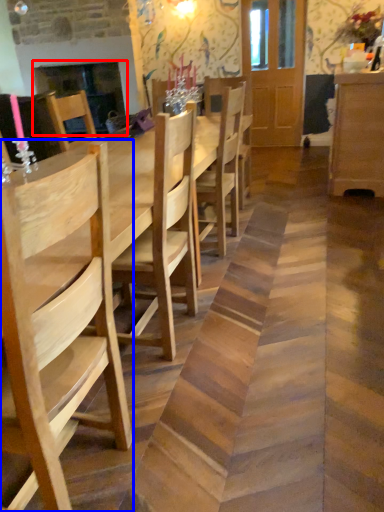
Question: Which object appears farthest to the camera in this image, fireplace (highlighted by a red box) or chair (highlighted by a blue box)?

Choices:
 (A) fireplace
 (B) chair

Answer: (A)